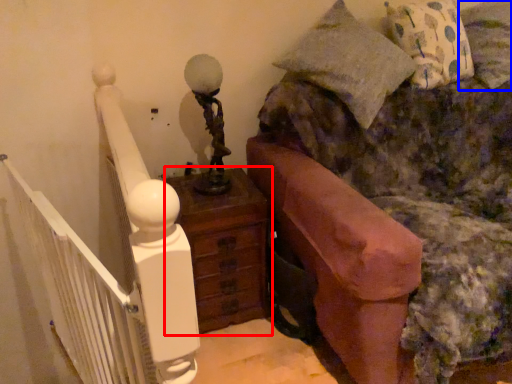
Question: Among these objects, which one is farthest to the camera, nightstand (highlighted by a red box) or pillow (highlighted by a blue box)?

Choices:
 (A) nightstand
 (B) pillow

Answer: (B)